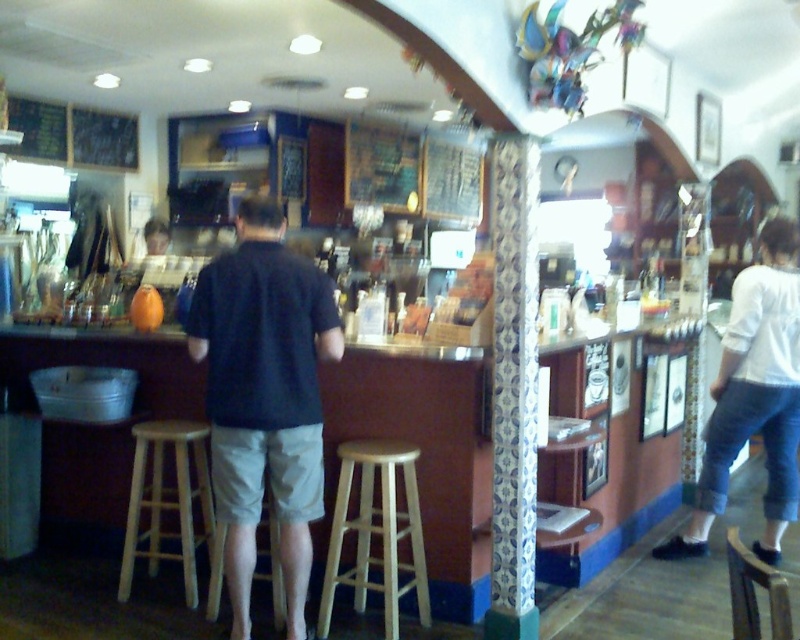
Consider the image. You are standing in the bar and want to grab a drink from the shelf behind the light brown wooden stool at center. Considering your height, you can reach up to 6 feet. Can you reach the top of the shelf?

The distance of light brown wooden stool at center from camera is 10.63 feet. Since the stool is 10.63 feet away, it is too far for you to reach the top of the shelf which you can only reach up to 6 feet.

You are a customer standing at the entrance of the bar. You see the dark blue shirt at center and the blue and white patterned column at center. Which object is closer to the floor?

The dark blue shirt at center is located below the blue and white patterned column at center, so the dark blue shirt at center is closer to the floor.

You are standing at the entrance of the bar and want to sit down at the light brown wooden stool at center. Based on the coordinates provided, in which direction should you walk to reach the stool?

The light brown wooden stool at center is located at coordinates point (168, 500). Since you are at the entrance, you should walk towards the center of the bar to reach the stool.